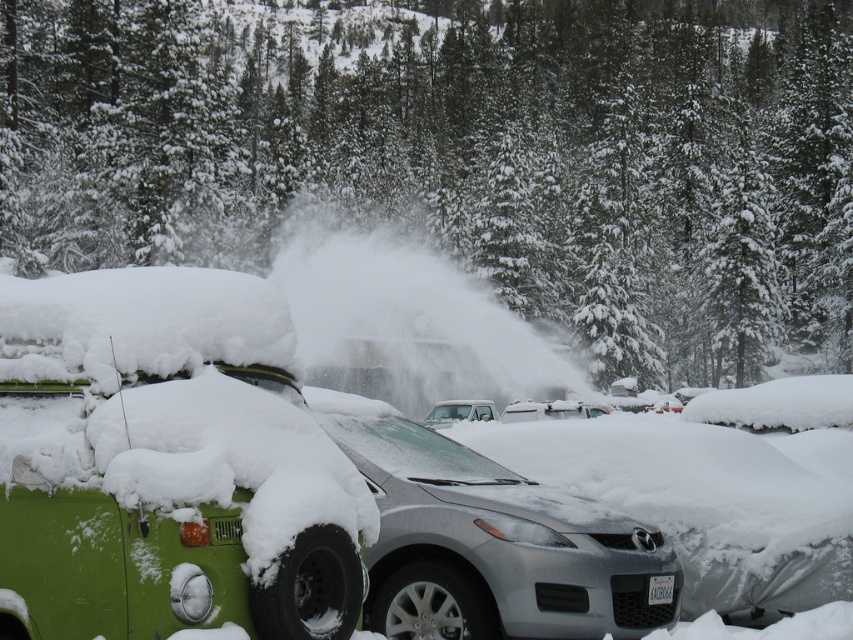
Question: Which is farther from the green matte van at left?

Choices:
 (A) white plastic license plate at center
 (B) white matte truck at center

Answer: (B)

Question: Is green matte van at left smaller than white matte truck at center?

Choices:
 (A) yes
 (B) no

Answer: (B)

Question: From the image, what is the correct spatial relationship of green matte van at left in relation to white matte truck at center?

Choices:
 (A) left
 (B) right

Answer: (A)

Question: Is green matte van at left positioned before white plastic license plate at center?

Choices:
 (A) no
 (B) yes

Answer: (B)

Question: Which object is the farthest from the white matte truck at center?

Choices:
 (A) green matte van at left
 (B) white plastic license plate at center

Answer: (A)

Question: Among these points, which one is farthest from the camera?

Choices:
 (A) (439, 412)
 (B) (660, 579)

Answer: (A)